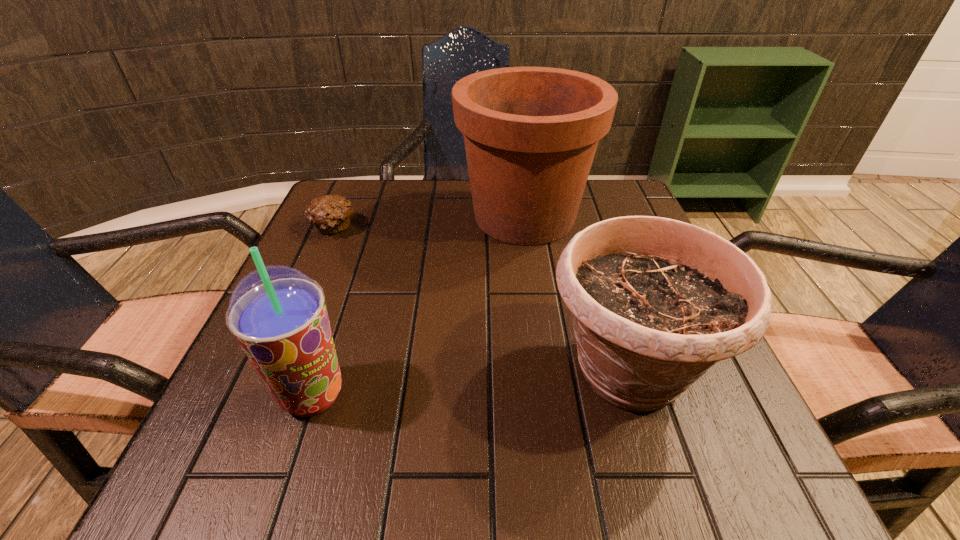
Where is `vacant point that satisfies the following two spatial constraints: 1. on the front side of the taller flowerpot; 2. on the right side of the second shortest object`? The image size is (960, 540). vacant point that satisfies the following two spatial constraints: 1. on the front side of the taller flowerpot; 2. on the right side of the second shortest object is located at coordinates (545, 371).

The height and width of the screenshot is (540, 960). In order to click on free space that satisfies the following two spatial constraints: 1. on the back side of the farther flowerpot; 2. on the left side of the shortest object in this screenshot , I will do [x=337, y=217].

Where is `free space that satisfies the following two spatial constraints: 1. on the back side of the shorter flowerpot; 2. on the right side of the smoothie`? The width and height of the screenshot is (960, 540). free space that satisfies the following two spatial constraints: 1. on the back side of the shorter flowerpot; 2. on the right side of the smoothie is located at coordinates (321, 371).

Identify the location of free space that satisfies the following two spatial constraints: 1. on the front side of the muffin; 2. on the left side of the shorter flowerpot. The width and height of the screenshot is (960, 540). (269, 371).

This screenshot has width=960, height=540. In order to click on vacant region that satisfies the following two spatial constraints: 1. on the front side of the second shortest object; 2. on the left side of the muffin in this screenshot , I will do `click(269, 371)`.

The height and width of the screenshot is (540, 960). In order to click on vacant space that satisfies the following two spatial constraints: 1. on the back side of the shorter flowerpot; 2. on the right side of the smoothie in this screenshot , I will do `click(321, 371)`.